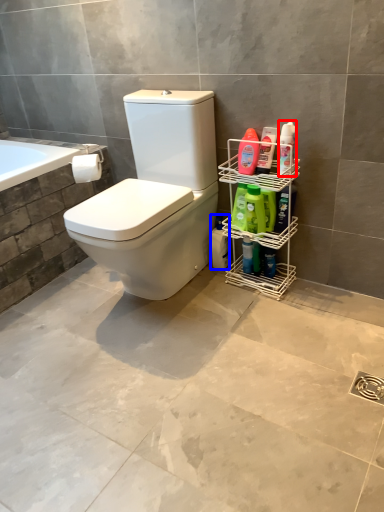
Question: Which point is closer to the camera, cleaning product (highlighted by a red box) or cleaning product (highlighted by a blue box)?

Choices:
 (A) cleaning product
 (B) cleaning product

Answer: (A)